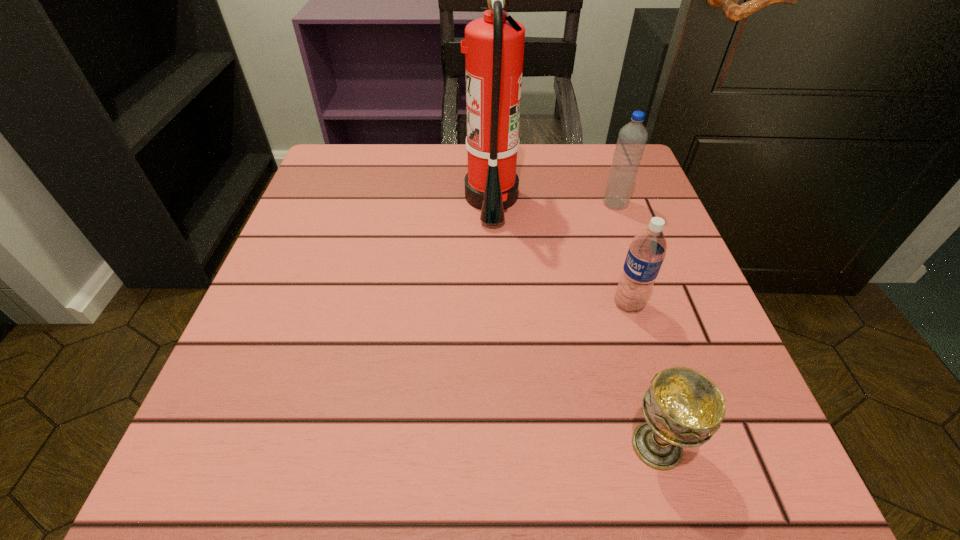
I want to click on free point between the leftmost object and the nearer water bottle, so click(x=560, y=251).

Where is `vacant area that lies between the chalice and the leftmost object`? Image resolution: width=960 pixels, height=540 pixels. vacant area that lies between the chalice and the leftmost object is located at coordinates (574, 322).

Identify the location of empty space that is in between the farther water bottle and the second nearest object. This screenshot has height=540, width=960. (622, 254).

Locate an element on the screen. The image size is (960, 540). empty space that is in between the chalice and the fire extinguisher is located at coordinates (574, 322).

The height and width of the screenshot is (540, 960). What are the coordinates of `unoccupied position between the farther water bottle and the leftmost object` in the screenshot? It's located at (553, 201).

At what (x,y) coordinates should I click in order to perform the action: click on object that is the third closest to the farther water bottle. Please return your answer as a coordinate pair (x, y). Looking at the image, I should click on (683, 408).

Select which object appears as the closest to the farther water bottle. Please provide its 2D coordinates. Your answer should be formatted as a tuple, i.e. [(x, y)], where the tuple contains the x and y coordinates of a point satisfying the conditions above.

[(493, 46)]

Image resolution: width=960 pixels, height=540 pixels. Identify the location of blank area in the image that satisfies the following two spatial constraints: 1. at the nozzle of the farther water bottle; 2. on the left side of the leftmost object. (492, 204).

Locate an element on the screen. free spot that satisfies the following two spatial constraints: 1. at the nozzle of the farther water bottle; 2. on the right side of the leftmost object is located at coordinates 492,204.

Locate an element on the screen. free spot that satisfies the following two spatial constraints: 1. at the nozzle of the farther water bottle; 2. on the left side of the leftmost object is located at coordinates (492, 204).